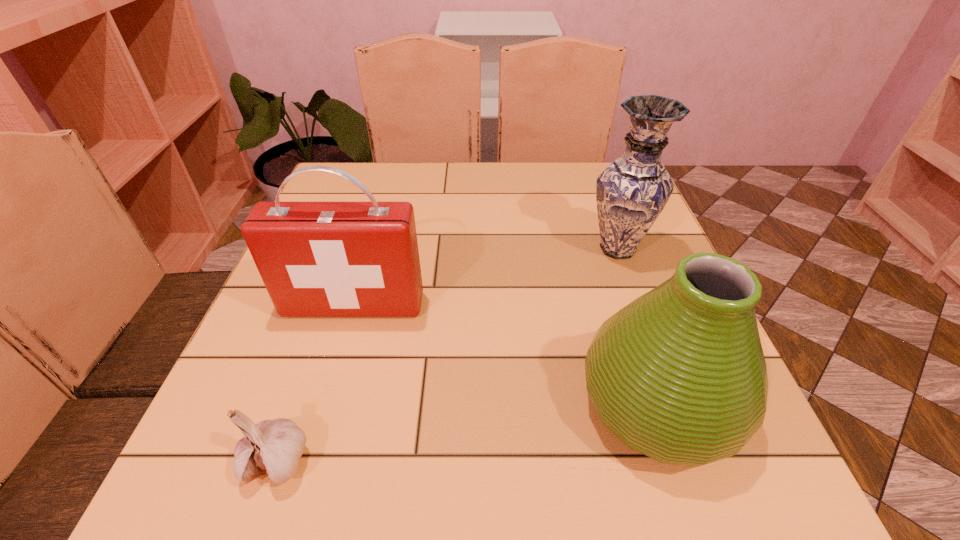
The image size is (960, 540). What are the coordinates of `the farthest object` in the screenshot? It's located at (631, 193).

Where is `the first-aid kit`? This screenshot has height=540, width=960. the first-aid kit is located at coordinates (317, 259).

The height and width of the screenshot is (540, 960). Identify the location of the shorter vase. (679, 374).

Find the location of a particular element. Image resolution: width=960 pixels, height=540 pixels. garlic is located at coordinates (274, 447).

Identify the location of vacant region located on the front of the farther vase. (664, 379).

The image size is (960, 540). Identify the location of vacant space located 0.100m on the front face of the first-aid kit. (337, 363).

Identify the location of free spot located on the left of the shorter vase. This screenshot has height=540, width=960. (416, 404).

You are a GUI agent. You are given a task and a screenshot of the screen. Output one action in this format:
    pyautogui.click(x=<x>, y=<y>)
    Task: Click on the vacant area situated 0.250m on the back of the garlic
    This screenshot has width=960, height=540.
    Given the screenshot: What is the action you would take?
    pyautogui.click(x=327, y=313)

I want to click on vase present at the near edge, so click(x=679, y=374).

This screenshot has height=540, width=960. What are the coordinates of `garlic at the near edge` in the screenshot? It's located at (274, 447).